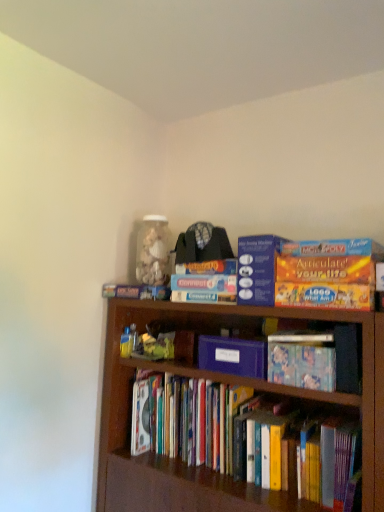
Question: Should I look upward or downward to see hardcover books at center, which ranks as the 1th book in bottom-to-top order?

Choices:
 (A) up
 (B) down

Answer: (B)

Question: Does orange matte board game at upper center, positioned as the 1th paperback book in top-to-bottom order, have a greater width compared to purple matte paper at center, marked as the 1th paperback book in a bottom-to-top arrangement?

Choices:
 (A) no
 (B) yes

Answer: (B)

Question: Does orange matte board game at upper center, positioned as the 1th paperback book in top-to-bottom order, turn towards purple matte paper at center, which ranks as the second paperback book in top-to-bottom order?

Choices:
 (A) yes
 (B) no

Answer: (B)

Question: Is orange matte board game at upper center, which appears as the second paperback book when ordered from the bottom, not near purple matte paper at center, which ranks as the second paperback book in top-to-bottom order?

Choices:
 (A) no
 (B) yes

Answer: (A)

Question: From a real-world perspective, is orange matte board game at upper center, positioned as the 1th paperback book in top-to-bottom order, positioned over purple matte paper at center, marked as the 1th paperback book in a bottom-to-top arrangement, based on gravity?

Choices:
 (A) no
 (B) yes

Answer: (B)

Question: Can you see orange matte board game at upper center, which appears as the second paperback book when ordered from the bottom, touching purple matte paper at center, marked as the 1th paperback book in a bottom-to-top arrangement?

Choices:
 (A) no
 (B) yes

Answer: (A)

Question: Is the position of orange matte board game at upper center, which appears as the second paperback book when ordered from the bottom, more distant than that of purple matte paper at center, which ranks as the second paperback book in top-to-bottom order?

Choices:
 (A) no
 (B) yes

Answer: (B)

Question: Is hardcover books at center, which ranks as the 1th book in bottom-to-top order, at the left side of blue cardboard connect 4 game at upper center, arranged as the third book when ordered from the bottom?

Choices:
 (A) no
 (B) yes

Answer: (A)

Question: Is hardcover books at center, placed as the third book when sorted from top to bottom, shorter than blue cardboard connect 4 game at upper center, arranged as the third book when ordered from the bottom?

Choices:
 (A) no
 (B) yes

Answer: (A)

Question: Is hardcover books at center, which ranks as the 1th book in bottom-to-top order, closer to camera compared to blue cardboard connect 4 game at upper center, arranged as the third book when ordered from the bottom?

Choices:
 (A) no
 (B) yes

Answer: (B)

Question: From the image's perspective, is hardcover books at center, which ranks as the 1th book in bottom-to-top order, over blue cardboard connect 4 game at upper center, which is the 1th book in top-to-bottom order?

Choices:
 (A) yes
 (B) no

Answer: (B)

Question: Does hardcover books at center, which ranks as the 1th book in bottom-to-top order, have a greater height compared to blue cardboard connect 4 game at upper center, arranged as the third book when ordered from the bottom?

Choices:
 (A) no
 (B) yes

Answer: (B)

Question: Is hardcover books at center, placed as the third book when sorted from top to bottom, not inside blue cardboard connect 4 game at upper center, arranged as the third book when ordered from the bottom?

Choices:
 (A) yes
 (B) no

Answer: (A)

Question: Is orange matte board game at upper center, positioned as the 1th paperback book in top-to-bottom order, placed right next to hardcover book at center, which appears as the 2th book when viewed from the top?

Choices:
 (A) no
 (B) yes

Answer: (A)